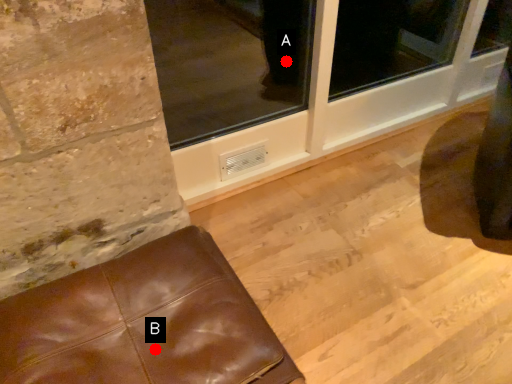
Question: Two points are circled on the image, labeled by A and B beside each circle. Which point is closer to the camera?

Choices:
 (A) A is closer
 (B) B is closer

Answer: (B)